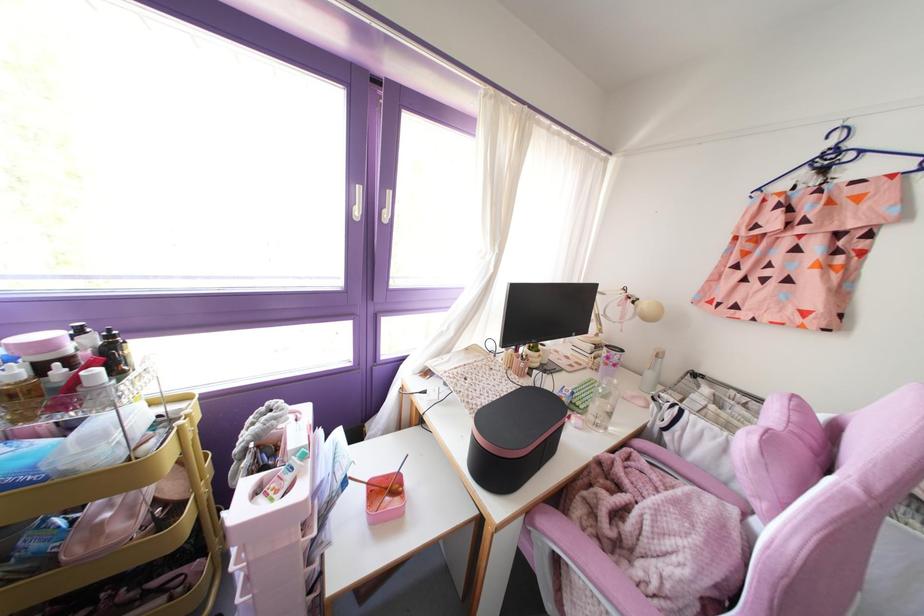
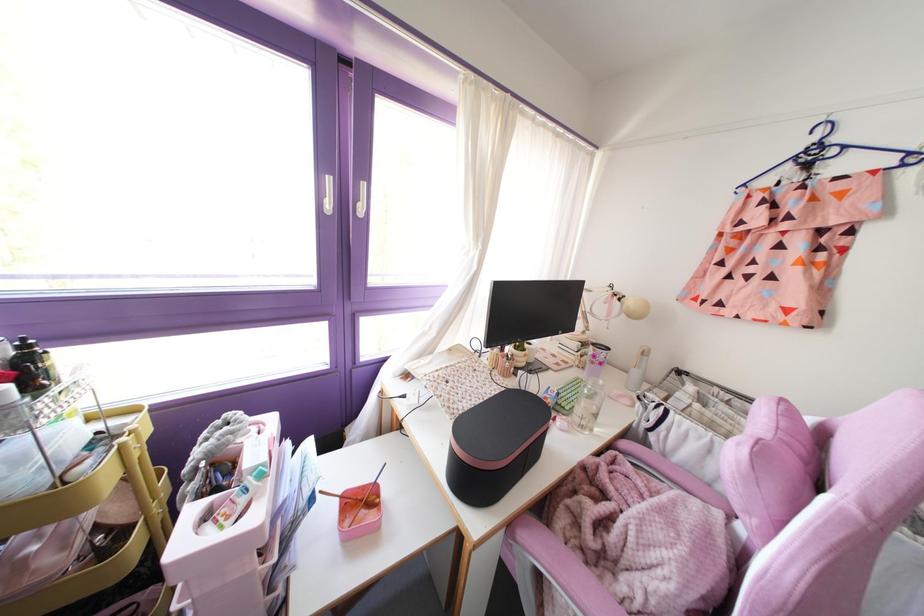
The point at (116,373) is marked in the first image. Where is the corresponding point in the second image?

(32, 389)